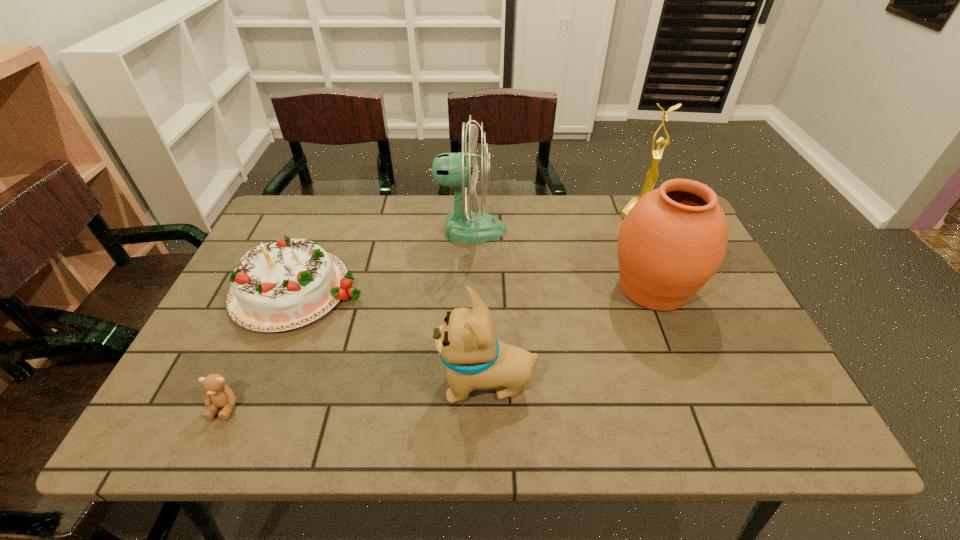
In order to click on vacant region located on the face of the third shortest object in this screenshot , I will do `click(263, 383)`.

Find the location of `free space located 0.400m on the face of the third shortest object`. free space located 0.400m on the face of the third shortest object is located at coordinates (253, 383).

The height and width of the screenshot is (540, 960). Identify the location of free space located 0.160m on the back of the cake. (329, 215).

Locate an element on the screen. The image size is (960, 540). award at the far edge is located at coordinates (652, 175).

Identify the location of fan that is at the far edge. (460, 170).

The image size is (960, 540). What are the coordinates of `puppy that is at the near edge` in the screenshot? It's located at (x=475, y=360).

You are a GUI agent. You are given a task and a screenshot of the screen. Output one action in this format:
    pyautogui.click(x=<x>, y=<y>)
    Task: Click on the teddy bear that is at the near edge
    
    Given the screenshot: What is the action you would take?
    pyautogui.click(x=219, y=395)

Where is `cake present at the left edge`? The height and width of the screenshot is (540, 960). cake present at the left edge is located at coordinates click(x=281, y=285).

I want to click on teddy bear that is positioned at the left edge, so click(219, 395).

Locate an element on the screen. award that is at the right edge is located at coordinates (652, 175).